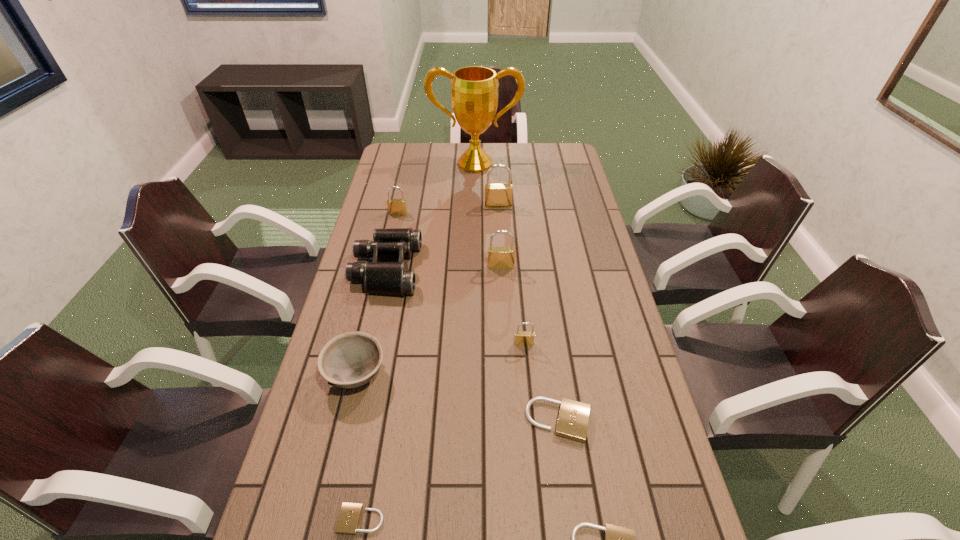
Identify the location of vacant area that lies between the shortest object and the farthest brass padlock. Image resolution: width=960 pixels, height=540 pixels. (430, 363).

You are a GUI agent. You are given a task and a screenshot of the screen. Output one action in this format:
    pyautogui.click(x=<x>, y=<y>)
    Task: Click on the object that ranks as the third closest to the eighth tallest object
    
    Given the screenshot: What is the action you would take?
    pyautogui.click(x=349, y=517)

You are a GUI agent. You are given a task and a screenshot of the screen. Output one action in this format:
    pyautogui.click(x=<x>, y=<y>)
    Task: Click on the fourth closest object relative to the leftmost brass padlock
    The height and width of the screenshot is (540, 960).
    Given the screenshot: What is the action you would take?
    pyautogui.click(x=498, y=257)

Choose which padlock is the fourth nearest neighbor to the third farthest object. Please provide its 2D coordinates. Your answer should be formatted as a tuple, i.e. [(x, y)], where the tuple contains the x and y coordinates of a point satisfying the conditions above.

[(573, 418)]

Point out which padlock is positioned as the fourth nearest to the smallest brass padlock. Please provide its 2D coordinates. Your answer should be formatted as a tuple, i.e. [(x, y)], where the tuple contains the x and y coordinates of a point satisfying the conditions above.

[(349, 517)]

Find the location of a particular element. the third closest brass padlock to the bowl is located at coordinates (395, 206).

The height and width of the screenshot is (540, 960). In order to click on the third closest brass padlock to the gray bowl in this screenshot , I will do `click(395, 206)`.

Point out which beige padlock is positioned as the nearest to the fifth tallest padlock. Please provide its 2D coordinates. Your answer should be formatted as a tuple, i.e. [(x, y)], where the tuple contains the x and y coordinates of a point satisfying the conditions above.

[(617, 539)]

Select which beige padlock appears as the second closest to the eighth tallest object. Please provide its 2D coordinates. Your answer should be formatted as a tuple, i.e. [(x, y)], where the tuple contains the x and y coordinates of a point satisfying the conditions above.

[(349, 517)]

The image size is (960, 540). I want to click on vacant region that satisfies the following two spatial constraints: 1. on the front-facing side of the eighth shortest object; 2. on the front-facing side of the black binoculars, so click(x=501, y=269).